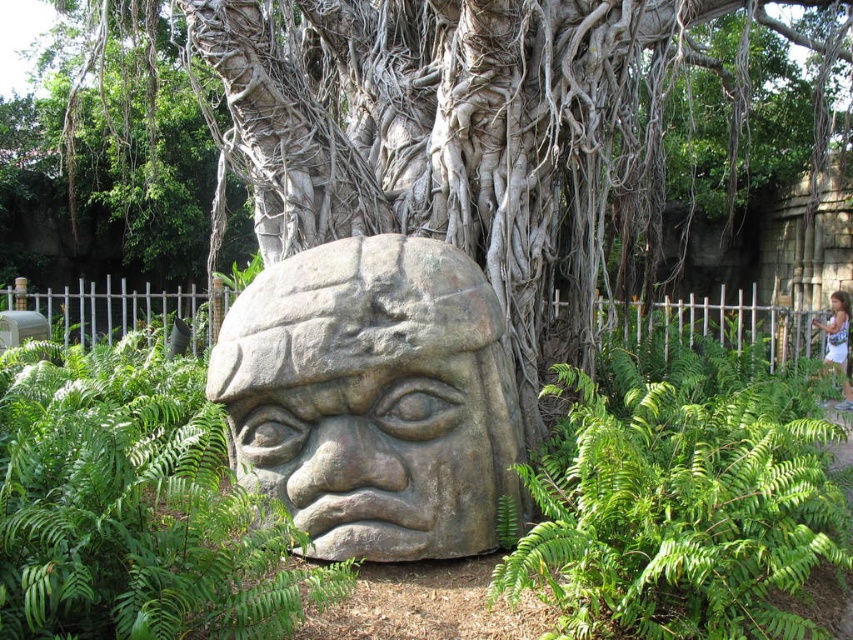
Question: Which object appears closest to the camera in this image?

Choices:
 (A) green leafy fern at lower center
 (B) gray stone head at center
 (C) smooth stone head at center
 (D) white cotton shirt at lower right

Answer: (A)

Question: Considering the relative positions of green leafy fern at center and smooth stone head at center in the image provided, where is green leafy fern at center located with respect to smooth stone head at center?

Choices:
 (A) above
 (B) below

Answer: (B)

Question: Is green leafy fern at lower center below white cotton shirt at lower right?

Choices:
 (A) yes
 (B) no

Answer: (A)

Question: Estimate the real-world distances between objects in this image. Which object is closer to the green leafy fern at center?

Choices:
 (A) white cotton shirt at lower right
 (B) green leafy fern at lower center

Answer: (B)

Question: Observing the image, what is the correct spatial positioning of green leafy fern at lower center in reference to gray stone head at center?

Choices:
 (A) left
 (B) right

Answer: (B)

Question: Among these objects, which one is farthest from the camera?

Choices:
 (A) smooth stone head at center
 (B) green leafy fern at center
 (C) green leafy fern at lower center
 (D) gray stone head at center

Answer: (A)